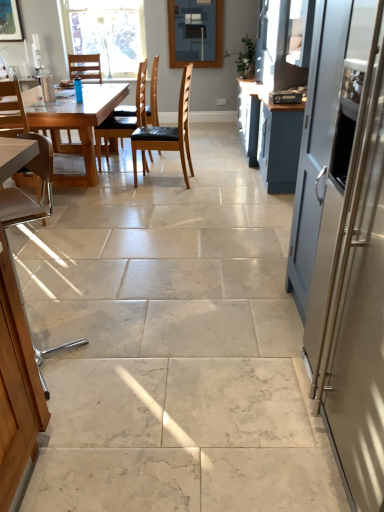
Identify the location of light brown leather chair at left, arranged as the fourth chair when viewed from the back. (12, 110).

The image size is (384, 512). Find the location of `brown leather chair at center, arranged as the 3th chair when viewed from the back`. brown leather chair at center, arranged as the 3th chair when viewed from the back is located at coordinates (167, 133).

Describe the element at coordinates (195, 33) in the screenshot. I see `matte glass window screen at upper center` at that location.

The image size is (384, 512). What do you see at coordinates (358, 304) in the screenshot?
I see `satin silver refrigerator at right` at bounding box center [358, 304].

Locate an element on the screen. light brown wooden table at left is located at coordinates (74, 125).

Describe the element at coordinates (74, 125) in the screenshot. I see `light brown wooden table at left` at that location.

Locate an element on the screen. blue plastic chair at upper left, the 1th chair from the back is located at coordinates (85, 67).

The height and width of the screenshot is (512, 384). Find the location of `screen door in front of the clear glass window at upper center`. screen door in front of the clear glass window at upper center is located at coordinates (358, 304).

How different are the orientations of clear glass window at upper center and satin silver refrigerator at right in degrees?

90.7 degrees.

From the image's perspective, which is below, clear glass window at upper center or satin silver refrigerator at right?

From the image's view, satin silver refrigerator at right is below.

Considering the sizes of objects clear glass window at upper center and satin silver refrigerator at right in the image provided, who is taller, clear glass window at upper center or satin silver refrigerator at right?

satin silver refrigerator at right.

Who is smaller, matte glass window screen at upper center or black leather chair at upper left, the second chair in the back-to-front sequence?

With smaller size is matte glass window screen at upper center.

Is point (172, 6) closer or farther from the camera than point (107, 126)?

Point (172, 6).

Looking at this image, is matte glass window screen at upper center aimed at black leather chair at upper left, which is the 3th chair in front-to-back order?

Yes, matte glass window screen at upper center faces towards black leather chair at upper left, which is the 3th chair in front-to-back order.

Relative to black leather chair at upper left, which is the 3th chair in front-to-back order, is matte glass window screen at upper center in front or behind?

In the image, matte glass window screen at upper center appears behind black leather chair at upper left, which is the 3th chair in front-to-back order.

Between black leather chair at upper left, which is the 3th chair in front-to-back order, and matte glass window screen at upper center, which one has less height?

matte glass window screen at upper center.

Can you confirm if black leather chair at upper left, which is the 3th chair in front-to-back order, is wider than matte glass window screen at upper center?

Indeed, black leather chair at upper left, which is the 3th chair in front-to-back order, has a greater width compared to matte glass window screen at upper center.

At what (x,y) coordinates should I click in order to perform the action: click on chair that is the 2nd one when counting leftward from the matte glass window screen at upper center. Please return your answer as a coordinate pair (x, y). Looking at the image, I should click on (123, 118).

Would you consider black leather chair at upper left, the second chair in the back-to-front sequence, to be distant from matte glass window screen at upper center?

Yes, black leather chair at upper left, the second chair in the back-to-front sequence, is far from matte glass window screen at upper center.

From a real-world perspective, is satin silver refrigerator at right above or below matte glass window screen at upper center?

satin silver refrigerator at right is below matte glass window screen at upper center.

Is satin silver refrigerator at right taller than matte glass window screen at upper center?

Yes, satin silver refrigerator at right is taller than matte glass window screen at upper center.

How different are the orientations of satin silver refrigerator at right and matte glass window screen at upper center in degrees?

They differ by 89.4 degrees in their facing directions.

Is matte glass window screen at upper center completely or partially inside satin silver refrigerator at right?

No, matte glass window screen at upper center is not a part of satin silver refrigerator at right.

From a real-world perspective, is brown leather chair at center, arranged as the 2th chair when viewed from the front, positioned above or below black leather chair at upper left, which is the 3th chair in front-to-back order?

brown leather chair at center, arranged as the 2th chair when viewed from the front, is above black leather chair at upper left, which is the 3th chair in front-to-back order.

Is black leather chair at upper left, which is the 3th chair in front-to-back order, located within brown leather chair at center, arranged as the 2th chair when viewed from the front?

Actually, black leather chair at upper left, which is the 3th chair in front-to-back order, is outside brown leather chair at center, arranged as the 2th chair when viewed from the front.

How much distance is there between brown leather chair at center, arranged as the 2th chair when viewed from the front, and black leather chair at upper left, which is the 3th chair in front-to-back order?

A distance of 19.01 inches exists between brown leather chair at center, arranged as the 2th chair when viewed from the front, and black leather chair at upper left, which is the 3th chair in front-to-back order.

Where is `the 1st chair in front of the black leather chair at upper left, which is the 3th chair in front-to-back order`? The height and width of the screenshot is (512, 384). the 1st chair in front of the black leather chair at upper left, which is the 3th chair in front-to-back order is located at coordinates (167, 133).

Is matte glass window screen at upper center in front of or behind satin silver refrigerator at right in the image?

Clearly, matte glass window screen at upper center is behind satin silver refrigerator at right.

Is point (185, 53) closer or farther from the camera than point (374, 434)?

Point (185, 53) is positioned farther from the camera compared to point (374, 434).

In the scene shown: Is matte glass window screen at upper center inside or outside of satin silver refrigerator at right?

matte glass window screen at upper center lies outside satin silver refrigerator at right.

Is matte glass window screen at upper center not inside light brown leather chair at left, the first chair viewed from the front?

matte glass window screen at upper center is positioned outside light brown leather chair at left, the first chair viewed from the front.

Looking at their sizes, would you say matte glass window screen at upper center is wider or thinner than light brown leather chair at left, arranged as the fourth chair when viewed from the back?

matte glass window screen at upper center is thinner than light brown leather chair at left, arranged as the fourth chair when viewed from the back.

From the image's perspective, which object appears higher, matte glass window screen at upper center or light brown leather chair at left, arranged as the fourth chair when viewed from the back?

matte glass window screen at upper center appears higher in the image.

Is matte glass window screen at upper center positioned with its back to light brown leather chair at left, arranged as the fourth chair when viewed from the back?

That's not correct — matte glass window screen at upper center is not looking away from light brown leather chair at left, arranged as the fourth chair when viewed from the back.

In order to click on screen door on the right of clear glass window at upper center in this screenshot , I will do `click(358, 304)`.

The width and height of the screenshot is (384, 512). Find the location of `the 4th chair directly beneath the matte glass window screen at upper center (from a real-world perspective)`. the 4th chair directly beneath the matte glass window screen at upper center (from a real-world perspective) is located at coordinates (123, 118).

Estimate the real-world distances between objects in this image. Which object is further from light brown leather chair at left, arranged as the fourth chair when viewed from the back, light brown wooden table at left or black leather chair at upper left, the second chair in the back-to-front sequence?

Based on the image, black leather chair at upper left, the second chair in the back-to-front sequence, appears to be further to light brown leather chair at left, arranged as the fourth chair when viewed from the back.

Considering their positions, is black leather chair at upper left, which is the 3th chair in front-to-back order, positioned further to clear glass window at upper center than satin silver refrigerator at right?

satin silver refrigerator at right is positioned further to the anchor clear glass window at upper center.

Based on their spatial positions, is black leather chair at upper left, the second chair in the back-to-front sequence, or matte glass window screen at upper center closer to brown leather chair at center, arranged as the 3th chair when viewed from the back?

Based on the image, black leather chair at upper left, the second chair in the back-to-front sequence, appears to be nearer to brown leather chair at center, arranged as the 3th chair when viewed from the back.

From the image, which object appears to be farther from light brown leather chair at left, arranged as the fourth chair when viewed from the back, satin silver refrigerator at right or black leather chair at upper left, which is the 3th chair in front-to-back order?

Based on the image, satin silver refrigerator at right appears to be further to light brown leather chair at left, arranged as the fourth chair when viewed from the back.

Looking at the image, which one is located closer to light brown leather chair at left, the first chair viewed from the front, blue plastic chair at upper left, the fourth chair when ordered from front to back, or brown leather chair at center, arranged as the 2th chair when viewed from the front?

Based on the image, brown leather chair at center, arranged as the 2th chair when viewed from the front, appears to be nearer to light brown leather chair at left, the first chair viewed from the front.

Looking at the image, which one is located further to blue plastic chair at upper left, the fourth chair when ordered from front to back, matte glass window screen at upper center or brown leather chair at center, arranged as the 3th chair when viewed from the back?

Among the two, brown leather chair at center, arranged as the 3th chair when viewed from the back, is located further to blue plastic chair at upper left, the fourth chair when ordered from front to back.

Estimate the real-world distances between objects in this image. Which object is closer to light brown leather chair at left, the first chair viewed from the front, brown leather chair at center, arranged as the 3th chair when viewed from the back, or satin silver refrigerator at right?

brown leather chair at center, arranged as the 3th chair when viewed from the back, is closer to light brown leather chair at left, the first chair viewed from the front.

From the image, which object appears to be farther from light brown leather chair at left, arranged as the fourth chair when viewed from the back, light brown wooden table at left or blue plastic chair at upper left, the fourth chair when ordered from front to back?

blue plastic chair at upper left, the fourth chair when ordered from front to back, lies further to light brown leather chair at left, arranged as the fourth chair when viewed from the back, than the other object.

Locate an element on the screen. kitchen & dining room table between satin silver refrigerator at right and black leather chair at upper left, the second chair in the back-to-front sequence, from front to back is located at coordinates (74, 125).

Identify the location of kitchen & dining room table between brown leather chair at center, arranged as the 3th chair when viewed from the back, and clear glass window at upper center in the front-back direction. Image resolution: width=384 pixels, height=512 pixels. (74, 125).

Where is `window screen positioned between brown leather chair at center, arranged as the 2th chair when viewed from the front, and clear glass window at upper center from near to far`? The height and width of the screenshot is (512, 384). window screen positioned between brown leather chair at center, arranged as the 2th chair when viewed from the front, and clear glass window at upper center from near to far is located at coordinates (195, 33).

Locate an element on the screen. chair between light brown wooden table at left and brown leather chair at center, arranged as the 2th chair when viewed from the front is located at coordinates (123, 118).